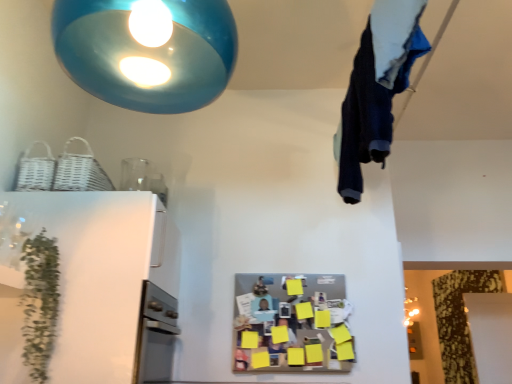
Question: Is dark blue fabric at upper right taller or shorter than glossy blue pendant light at upper center?

Choices:
 (A) short
 (B) tall

Answer: (B)

Question: From a real-world perspective, is dark blue fabric at upper right positioned above or below glossy blue pendant light at upper center?

Choices:
 (A) below
 (B) above

Answer: (A)

Question: Which object is the closest to the dark blue fabric at upper right?

Choices:
 (A) green leafy plant at left
 (B) glossy blue pendant light at upper center
 (C) white glossy refrigerator at left

Answer: (B)

Question: Estimate the real-world distances between objects in this image. Which object is farther from the green leafy plant at left?

Choices:
 (A) white glossy refrigerator at left
 (B) dark blue fabric at upper right
 (C) glossy blue pendant light at upper center

Answer: (B)